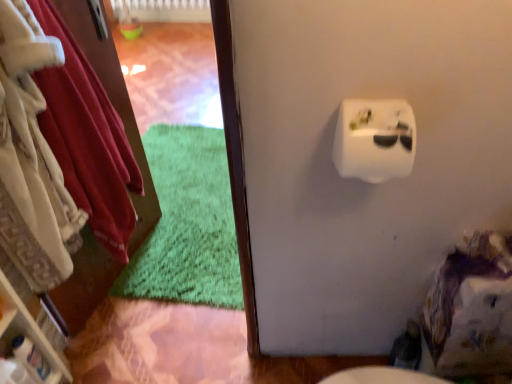
Question: Visually, is white plastic shelf at left positioned to the left or to the right of white plastic toilet paper at upper right?

Choices:
 (A) right
 (B) left

Answer: (B)

Question: In the image, is white plastic shelf at left positioned in front of or behind white plastic toilet paper at upper right?

Choices:
 (A) front
 (B) behind

Answer: (B)

Question: Estimate the real-world distances between objects in this image. Which object is closer to the velvety white robe at left?

Choices:
 (A) white plastic shelf at left
 (B) white plastic toilet paper at upper right

Answer: (A)

Question: Estimate the real-world distances between objects in this image. Which object is farther from the white plastic shelf at left?

Choices:
 (A) white plastic toilet paper at upper right
 (B) velvety white robe at left

Answer: (A)